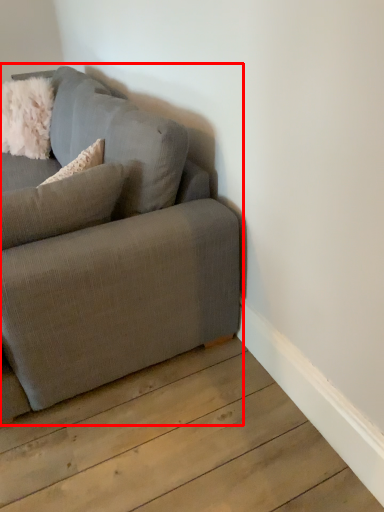
Question: From the image's perspective, what is the correct spatial relationship of studio couch (annotated by the red box) in relation to pillow?

Choices:
 (A) above
 (B) below

Answer: (A)